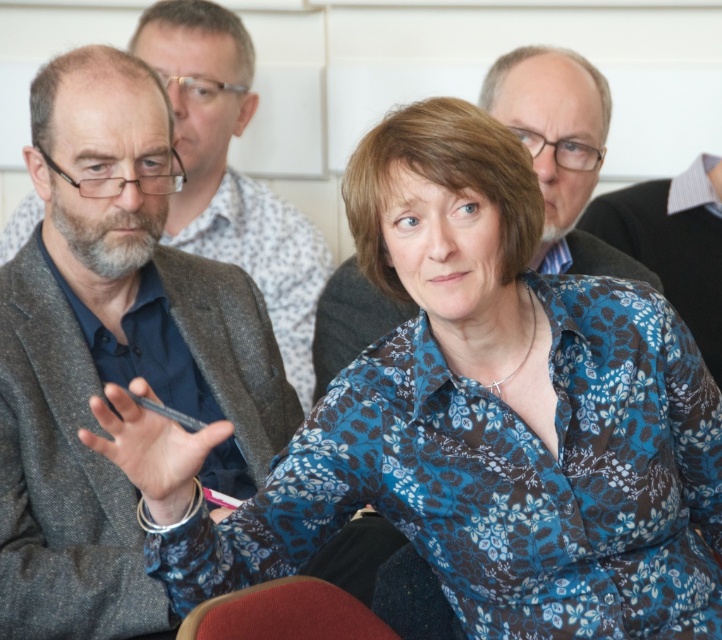
Is matte black jacket at upper center to the right of red fabric chair at lower center from the viewer's perspective?

Correct, you'll find matte black jacket at upper center to the right of red fabric chair at lower center.

Which is more to the right, matte black jacket at upper center or red fabric chair at lower center?

From the viewer's perspective, matte black jacket at upper center appears more on the right side.

Describe the element at coordinates (560, 148) in the screenshot. The height and width of the screenshot is (640, 722). I see `matte black jacket at upper center` at that location.

Where is `matte black jacket at upper center`? matte black jacket at upper center is located at coordinates (560, 148).

Who is positioned more to the left, gray woolen jacket at center or red fabric chair at lower center?

Positioned to the left is gray woolen jacket at center.

Who is lower down, gray woolen jacket at center or red fabric chair at lower center?

Positioned lower is red fabric chair at lower center.

The height and width of the screenshot is (640, 722). What do you see at coordinates (230, 172) in the screenshot?
I see `gray woolen jacket at center` at bounding box center [230, 172].

The image size is (722, 640). Find the location of `gray woolen jacket at center`. gray woolen jacket at center is located at coordinates (230, 172).

Measure the distance between point (230, 198) and camera.

A distance of 7.97 feet exists between point (230, 198) and camera.

How far apart are gray woolen jacket at center and matte black jacket at upper center?

gray woolen jacket at center is 26.03 inches from matte black jacket at upper center.

Which is behind, point (269, 250) or point (580, 122)?

The point (269, 250) is behind.

Identify the location of gray woolen jacket at center. Image resolution: width=722 pixels, height=640 pixels. (230, 172).